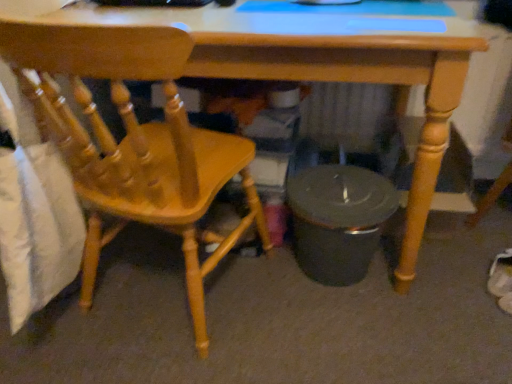
Describe the element at coordinates (133, 142) in the screenshot. I see `matte wood chair at left` at that location.

Measure the distance between matte wood chair at left and camera.

matte wood chair at left is 26.45 inches from camera.

Where is `matte wood chair at left`? This screenshot has height=384, width=512. matte wood chair at left is located at coordinates (133, 142).

Find the location of a particular element. The width and height of the screenshot is (512, 384). wooden desk at center is located at coordinates (323, 72).

The height and width of the screenshot is (384, 512). Describe the element at coordinates (323, 72) in the screenshot. I see `wooden desk at center` at that location.

Where is `matte wood chair at left`? matte wood chair at left is located at coordinates (133, 142).

Does wooden desk at center appear on the left side of matte wood chair at left?

No.

Which is behind, wooden desk at center or matte wood chair at left?

wooden desk at center is further from the camera.

Is point (147, 19) positioned in front of point (3, 38)?

No, (147, 19) is further to viewer.

From the image's perspective, is wooden desk at center below matte wood chair at left?

Incorrect, from the image's perspective, wooden desk at center is higher than matte wood chair at left.

From a real-world perspective, is wooden desk at center positioned under matte wood chair at left based on gravity?

Yes.

Which of these two, wooden desk at center or matte wood chair at left, is wider?

Wider between the two is wooden desk at center.

Does wooden desk at center have a greater height compared to matte wood chair at left?

No.

Considering the sizes of objects wooden desk at center and matte wood chair at left in the image provided, who is bigger, wooden desk at center or matte wood chair at left?

wooden desk at center is bigger.

Is wooden desk at center outside of matte wood chair at left?

Indeed, wooden desk at center is completely outside matte wood chair at left.

Are wooden desk at center and matte wood chair at left far apart?

No, wooden desk at center is in close proximity to matte wood chair at left.

Does wooden desk at center turn towards matte wood chair at left?

Yes, wooden desk at center is turned towards matte wood chair at left.

How different are the orientations of wooden desk at center and matte wood chair at left in degrees?

The angle between the facing direction of wooden desk at center and the facing direction of matte wood chair at left is 170 degrees.

How distant is wooden desk at center from matte wood chair at left?

wooden desk at center and matte wood chair at left are 12.32 inches apart.

Image resolution: width=512 pixels, height=384 pixels. I want to click on chair that appears on the left of wooden desk at center, so (133, 142).

Is matte wood chair at left to the left of wooden desk at center from the viewer's perspective?

Indeed, matte wood chair at left is positioned on the left side of wooden desk at center.

Considering their positions, is matte wood chair at left located in front of or behind wooden desk at center?

Visually, matte wood chair at left is located in front of wooden desk at center.

Considering the positions of points (67, 126) and (14, 13), is point (67, 126) farther from camera compared to point (14, 13)?

Yes, it is behind point (14, 13).

From the image's perspective, is matte wood chair at left positioned above or below wooden desk at center?

Based on their image positions, matte wood chair at left is located beneath wooden desk at center.

From a real-world perspective, is matte wood chair at left positioned under wooden desk at center based on gravity?

Incorrect, from a real-world perspective, matte wood chair at left is higher than wooden desk at center.

Between matte wood chair at left and wooden desk at center, which one has smaller width?

matte wood chair at left is thinner.

Considering the relative sizes of matte wood chair at left and wooden desk at center in the image provided, is matte wood chair at left taller than wooden desk at center?

Yes.

In terms of size, does matte wood chair at left appear bigger or smaller than wooden desk at center?

In the image, matte wood chair at left appears to be smaller than wooden desk at center.

Is matte wood chair at left inside or outside of wooden desk at center?

matte wood chair at left fits inside wooden desk at center.

Is matte wood chair at left touching wooden desk at center?

matte wood chair at left and wooden desk at center are not in contact.

Looking at this image, is matte wood chair at left oriented towards wooden desk at center?

Yes, matte wood chair at left is facing wooden desk at center.

How far apart are matte wood chair at left and wooden desk at center?

They are 12.32 inches apart.

Locate an element on the screen. Image resolution: width=512 pixels, height=384 pixels. desk behind the matte wood chair at left is located at coordinates [323, 72].

Find the location of `desk located behind the matte wood chair at left`. desk located behind the matte wood chair at left is located at coordinates (323, 72).

Find the location of `chair on the left of wooden desk at center`. chair on the left of wooden desk at center is located at coordinates (133, 142).